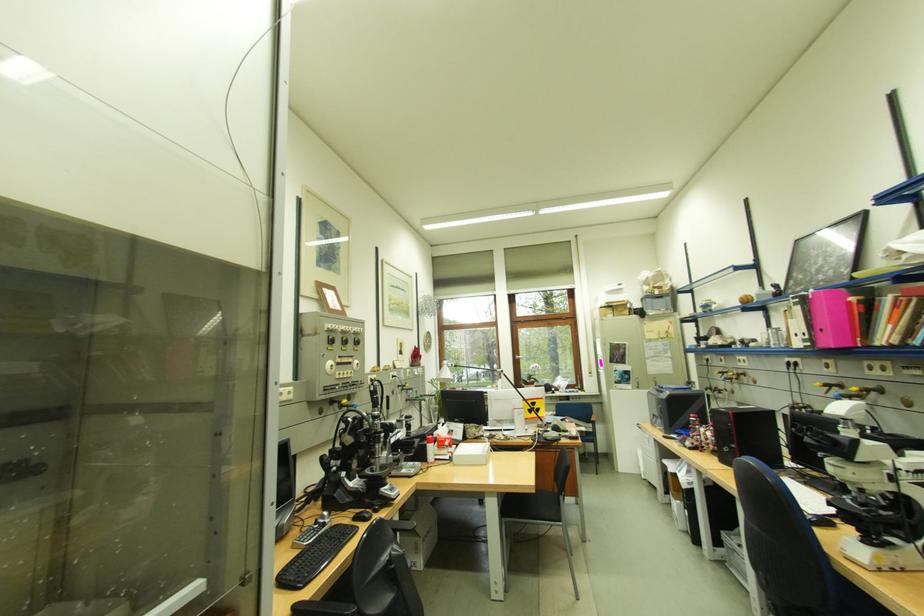
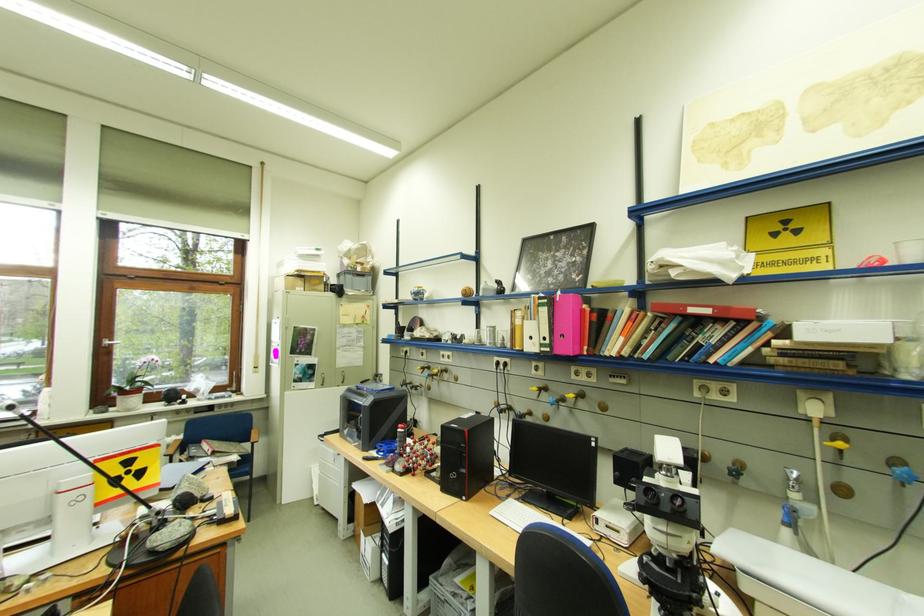
Locate, in the second image, the point that corresponds to pixel 830 386 in the first image.

(544, 390)